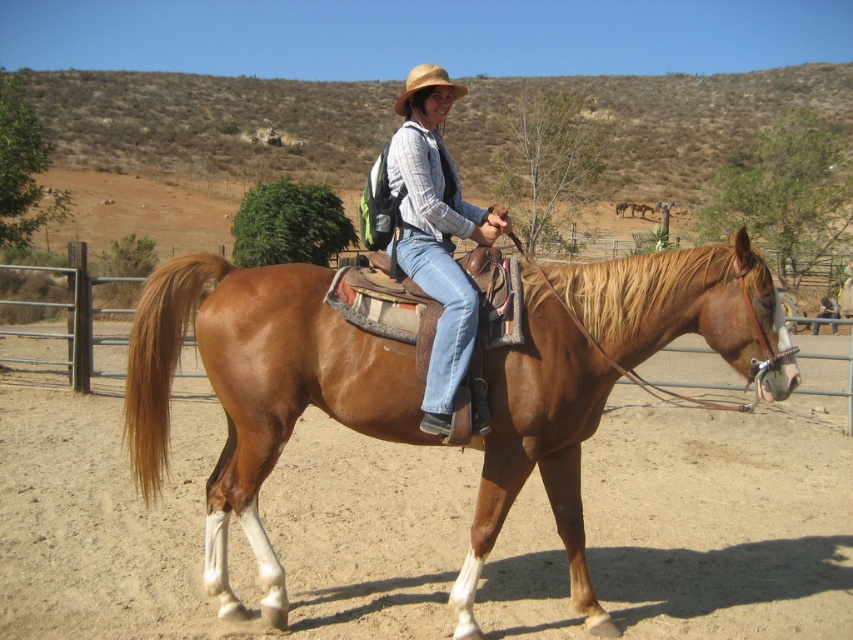
You are a photographer trying to capture a shot of the brown leather saddle at center and the straw hat at upper center. From the perspective of the rider, which object is positioned to the right side?

The brown leather saddle at center is positioned to the right of the straw hat at upper center.